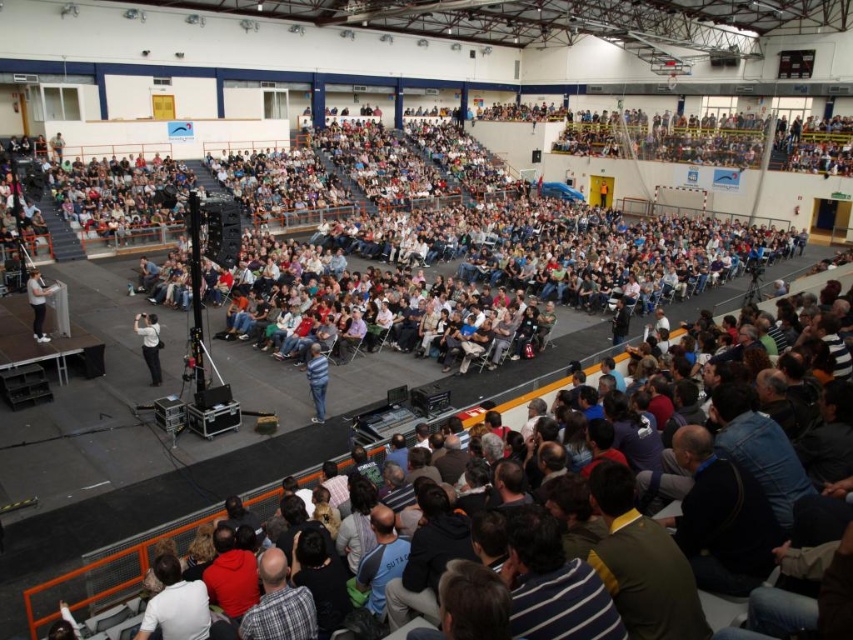
Question: Is striped shirt at center further to camera compared to white fabric shirt at left?

Choices:
 (A) no
 (B) yes

Answer: (A)

Question: Considering the relative positions of striped shirt at center and white fabric shirt at left in the image provided, where is striped shirt at center located with respect to white fabric shirt at left?

Choices:
 (A) below
 (B) above

Answer: (A)

Question: Which object appears closest to the camera in this image?

Choices:
 (A) white matte shirt at center
 (B) white fabric shirt at left

Answer: (A)

Question: Among these objects, which one is farthest from the camera?

Choices:
 (A) striped shirt at center
 (B) white matte shirt at center
 (C) white fabric shirt at left

Answer: (C)

Question: Can you confirm if striped shirt at center is positioned above white fabric shirt at left?

Choices:
 (A) yes
 (B) no

Answer: (B)

Question: Which of these objects is positioned farthest from the striped shirt at center?

Choices:
 (A) white fabric shirt at left
 (B) white matte shirt at center

Answer: (A)